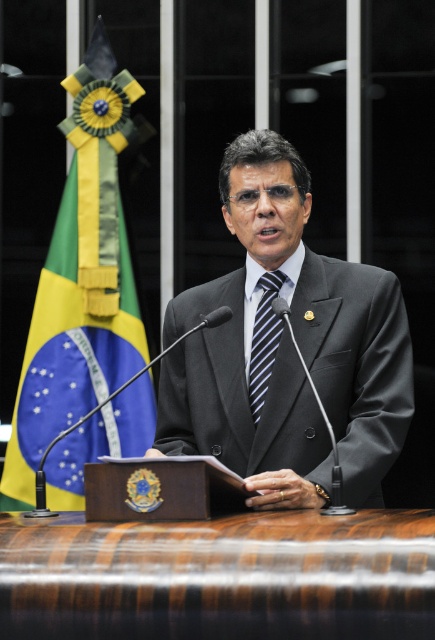
You are a photographer standing 12 inches away from the dark gray suit at center. Can you reach the blue striped tie at center without moving your position?

The dark gray suit at center is 10.30 inches away from the blue striped tie at center. Since you are 12 inches away from the dark gray suit at center, the blue striped tie at center is 12 inches plus 10.30 inches away from you, totaling 22.3 inches. Therefore, you cannot reach the blue striped tie at center without moving your position.